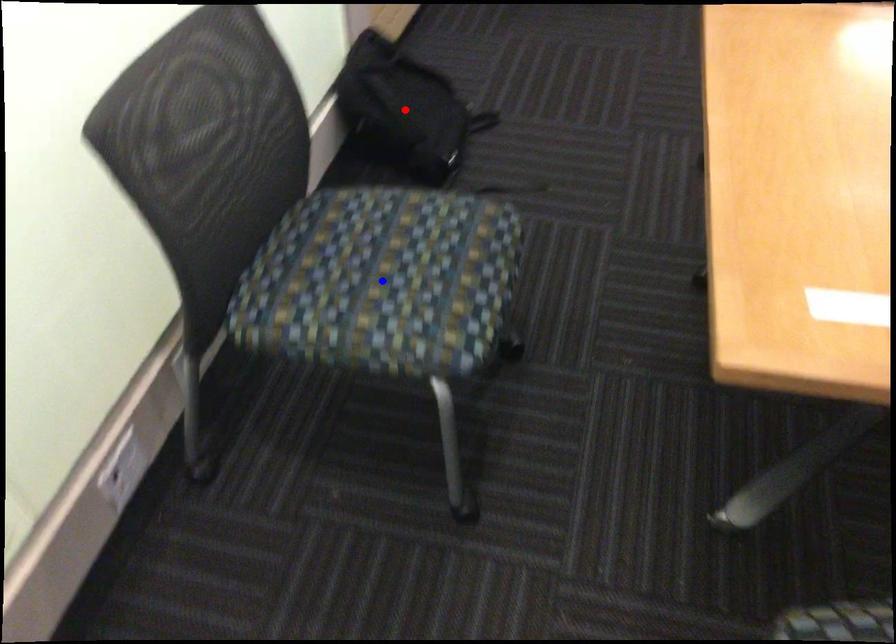
Question: Which of the two points in the image is closer to the camera?

Choices:
 (A) Blue point is closer.
 (B) Red point is closer.

Answer: (A)